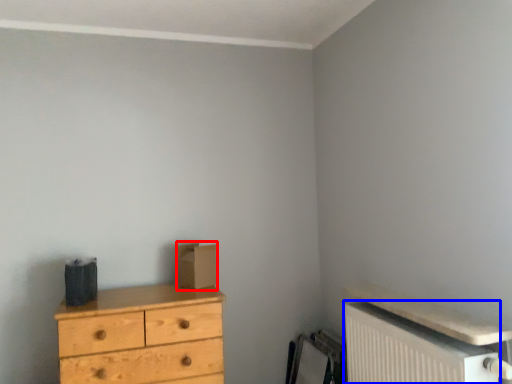
Question: Among these objects, which one is nearest to the camera, cardboard box (highlighted by a red box) or radiator (highlighted by a blue box)?

Choices:
 (A) cardboard box
 (B) radiator

Answer: (B)